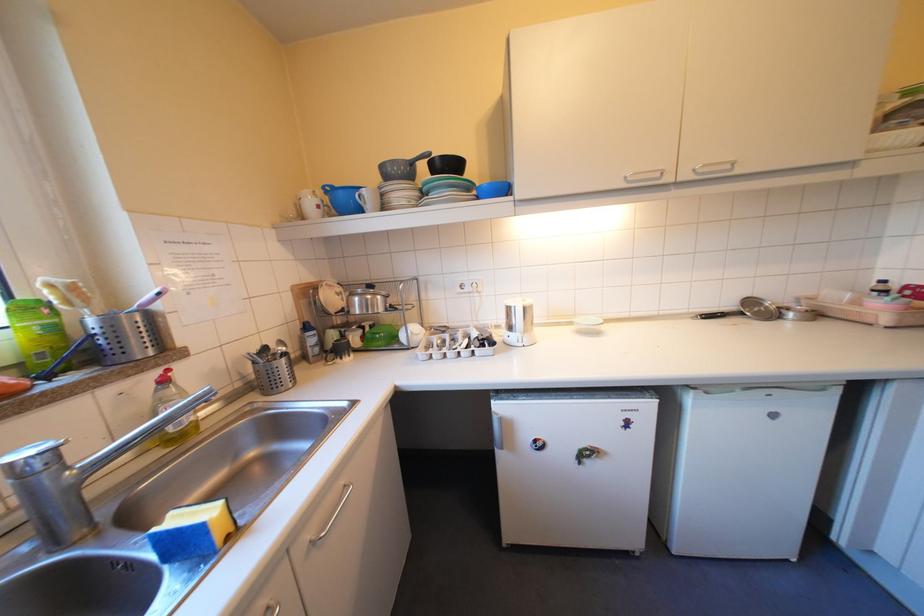
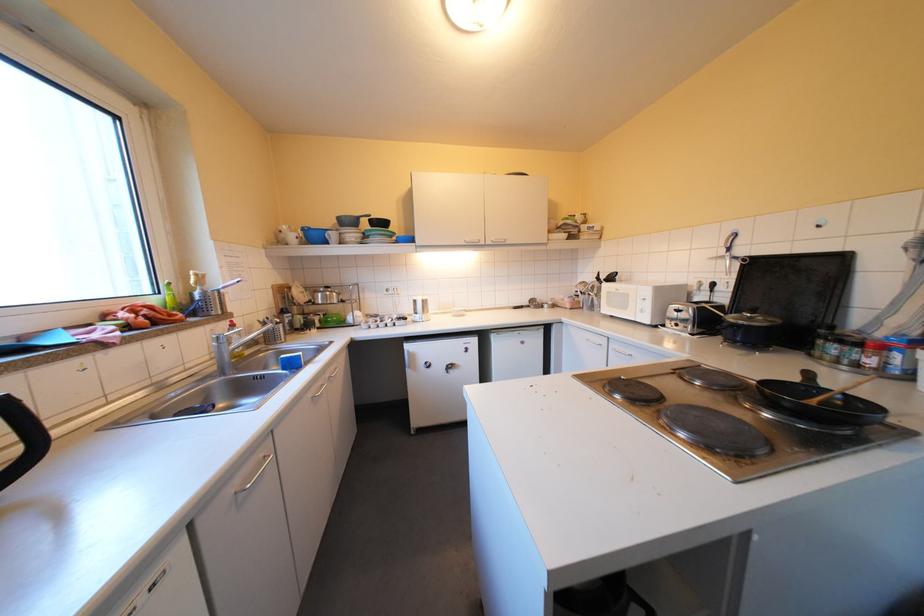
Find the pixel in the second image that matches point 575,448 in the first image.

(452, 366)